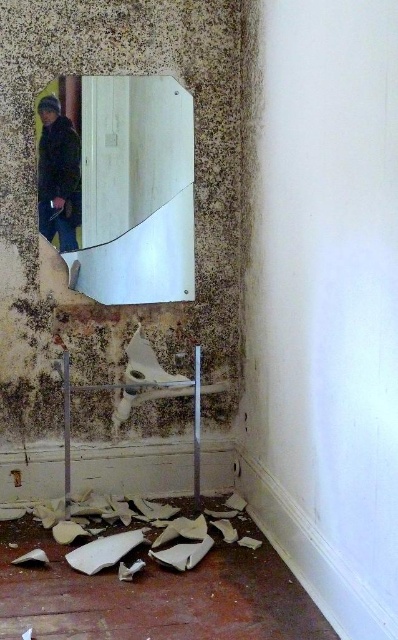
You are a home inspector assessing the room. You notice the dark blue jacket at left and the white matte debris at lower center. Based on their positions, which object is closer to the entrance of the room?

The dark blue jacket at left is closer to the entrance because the white matte debris at lower center is to the right of it, implying the jacket is nearer to the entrance.

You are a home inspector assessing the room. You notice the white matte debris at lower center and the dark blue jacket at left. Which object is bigger in size?

The white matte debris at lower center has a larger size compared to the dark blue jacket at left, so the white matte debris at lower center is bigger.